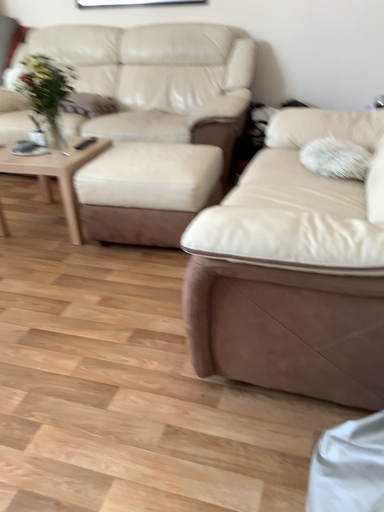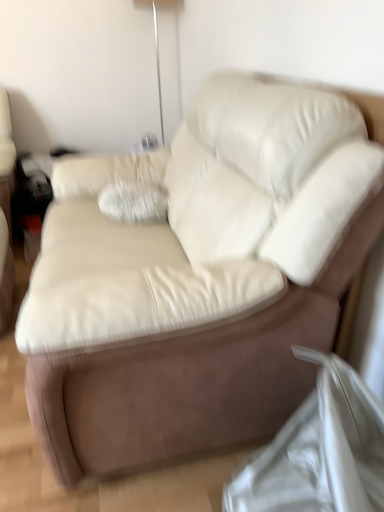
Question: Which way did the camera rotate in the video?

Choices:
 (A) rotated downward
 (B) rotated upward

Answer: (B)